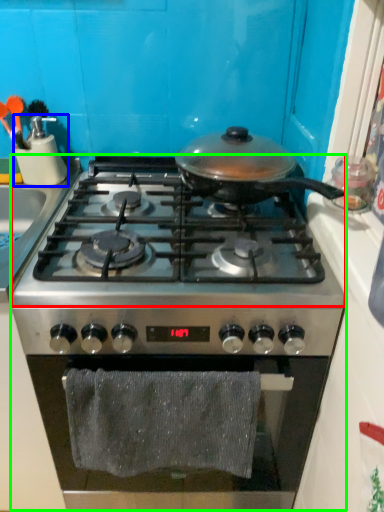
Question: Which object is the closest to the gas stove (highlighted by a red box)? Choose among these: kitchen appliance (highlighted by a blue box) or gas stove (highlighted by a green box).

Choices:
 (A) kitchen appliance
 (B) gas stove

Answer: (B)